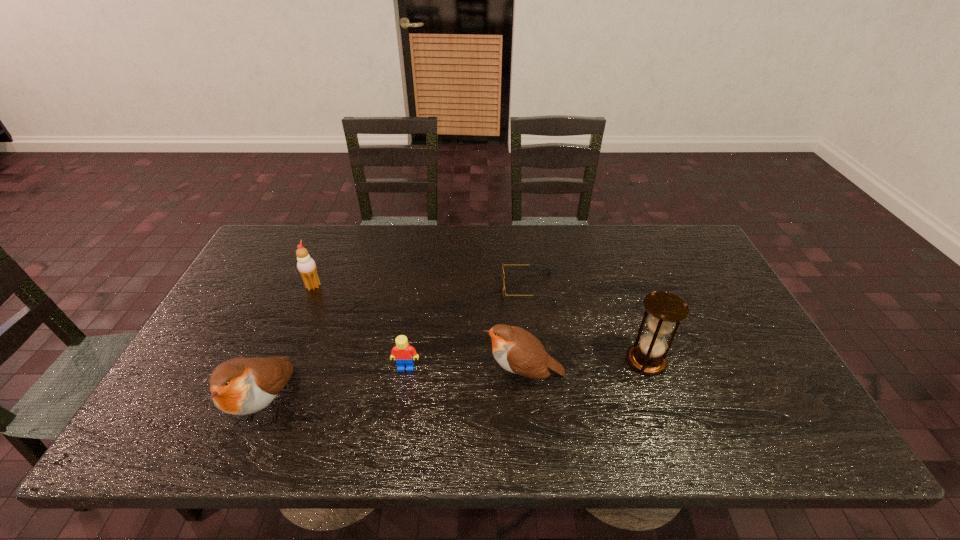
Please point a spot on the right to add another bird. Please provide its 2D coordinates. Your answer should be formatted as a tuple, i.e. [(x, y)], where the tuple contains the x and y coordinates of a point satisfying the conditions above.

[(753, 349)]